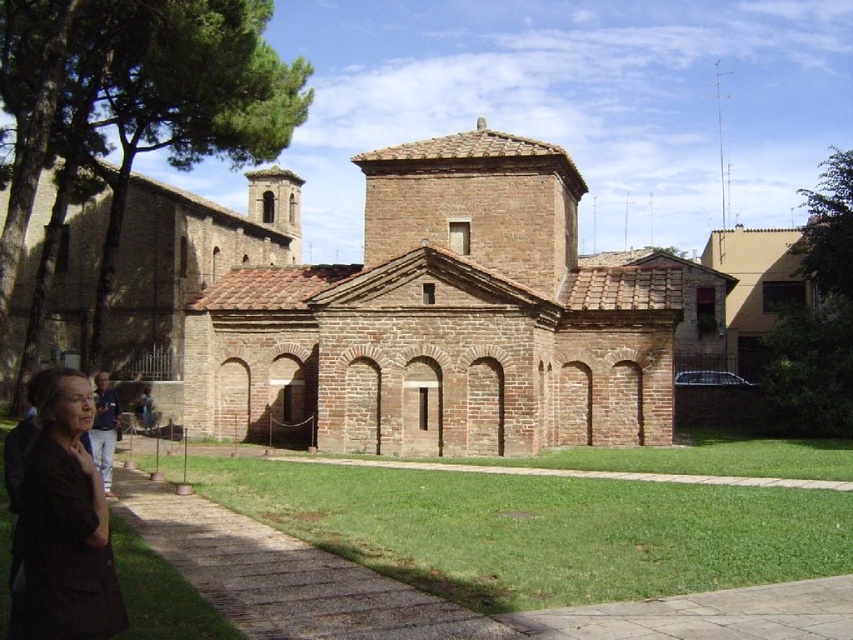
Question: Can you confirm if brown brick chapel at center is positioned below dark brown fabric at lower left?

Choices:
 (A) yes
 (B) no

Answer: (B)

Question: Does brown brick chapel at center have a lesser width compared to dark brown fabric at lower left?

Choices:
 (A) yes
 (B) no

Answer: (B)

Question: Is brown brick chapel at center further to the viewer compared to dark brown fabric at lower left?

Choices:
 (A) yes
 (B) no

Answer: (A)